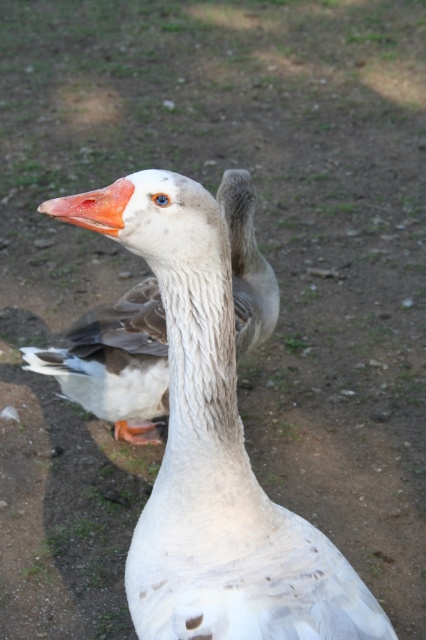
Question: Can you confirm if white feathered duck at center is positioned below orange matte beak at center?

Choices:
 (A) no
 (B) yes

Answer: (B)

Question: Which object appears closest to the camera in this image?

Choices:
 (A) white feathered duck at center
 (B) white feathered goose at center

Answer: (A)

Question: Which object is the closest to the white feathered goose at center?

Choices:
 (A) orange matte beak at center
 (B) white feathered duck at center

Answer: (B)

Question: Which object appears farthest from the camera in this image?

Choices:
 (A) white feathered goose at center
 (B) white feathered duck at center

Answer: (A)

Question: In this image, where is white feathered duck at center located relative to orange matte beak at center?

Choices:
 (A) below
 (B) above

Answer: (A)

Question: Can you confirm if white feathered duck at center is positioned above white feathered goose at center?

Choices:
 (A) no
 (B) yes

Answer: (B)